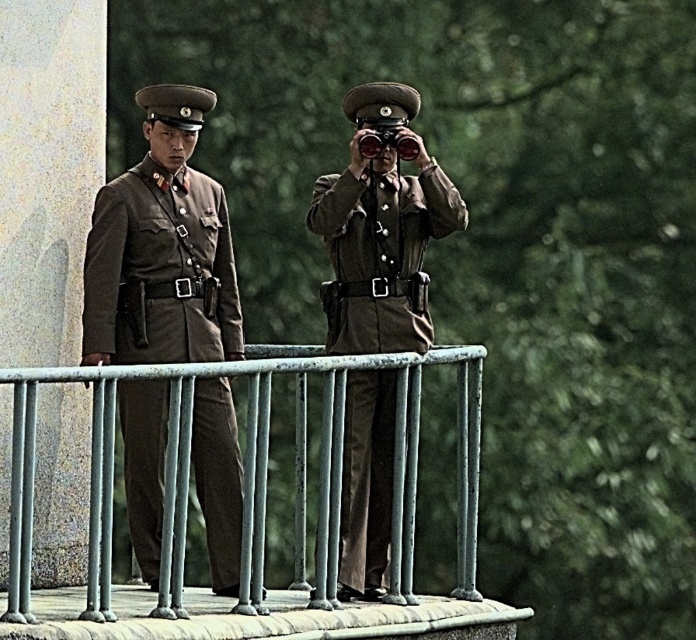
You are a soldier on the balcony and need to pass an object from one side of the metallic gray fence at center to the matte black binoculars at center. Can you do this without moving the fence?

The metallic gray fence at center might be wider than matte black binoculars at center, so it depends on the exact width. If the fence is indeed wider, the object can be passed over it. If not, alternative methods may be needed.